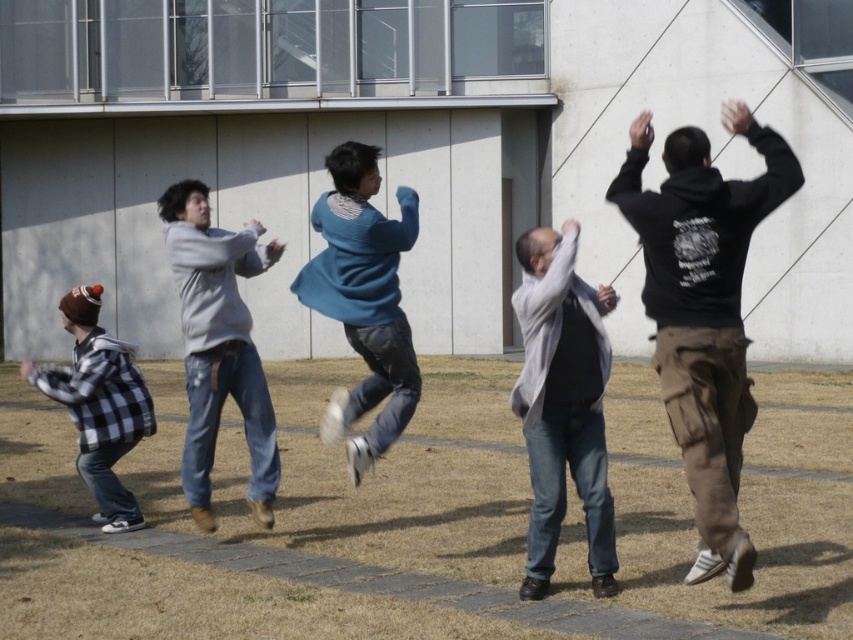
Does point (694, 392) come in front of point (364, 461)?

That is True.

Locate an element on the screen. black matte hoodie at right is located at coordinates (703, 310).

Which of these two, black matte hoodie at right or gray cotton shirt at center, stands shorter?

Standing shorter between the two is gray cotton shirt at center.

Where is `black matte hoodie at right`? black matte hoodie at right is located at coordinates (703, 310).

Where is `black matte hoodie at right`? The width and height of the screenshot is (853, 640). black matte hoodie at right is located at coordinates (703, 310).

Is point (531, 292) farther from viewer compared to point (378, 340)?

No, (531, 292) is closer to viewer.

Find the location of a particular element. The width and height of the screenshot is (853, 640). gray cotton shirt at center is located at coordinates (561, 403).